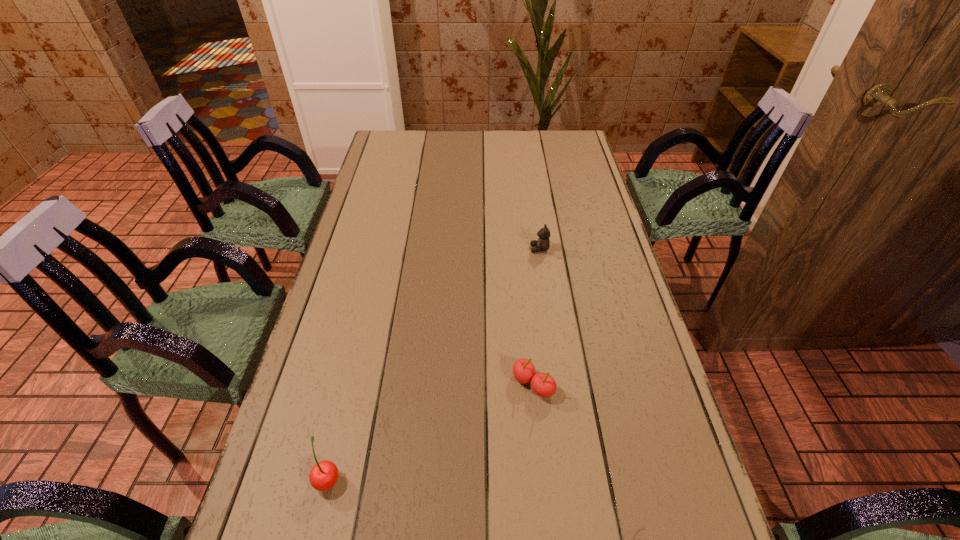
At what (x,y) coordinates should I click in order to perform the action: click on the tallest object. Please return your answer as a coordinate pair (x, y). This screenshot has width=960, height=540. Looking at the image, I should click on (323, 476).

This screenshot has height=540, width=960. Find the location of `the left cherry`. the left cherry is located at coordinates (323, 476).

Image resolution: width=960 pixels, height=540 pixels. In order to click on the shorter cherry in this screenshot , I will do `click(543, 384)`.

Find the location of a particular element. The height and width of the screenshot is (540, 960). the second nearest object is located at coordinates (543, 384).

Where is `teddy bear`? teddy bear is located at coordinates (543, 243).

Locate an element on the screen. vacant space situated on the back of the nearest object is located at coordinates (361, 342).

The height and width of the screenshot is (540, 960). Find the location of `blank space located 0.160m on the front of the second farthest object`. blank space located 0.160m on the front of the second farthest object is located at coordinates (542, 476).

The width and height of the screenshot is (960, 540). What are the coordinates of `free location located 0.100m on the face of the farthest object` in the screenshot? It's located at coord(497,249).

At what (x,y) coordinates should I click in order to perform the action: click on vacant space located 0.300m on the face of the farthest object. Please return your answer as a coordinate pair (x, y). This screenshot has width=960, height=540. Looking at the image, I should click on (433, 249).

Identify the location of vacant space located on the face of the farthest object. The width and height of the screenshot is (960, 540). (507, 249).